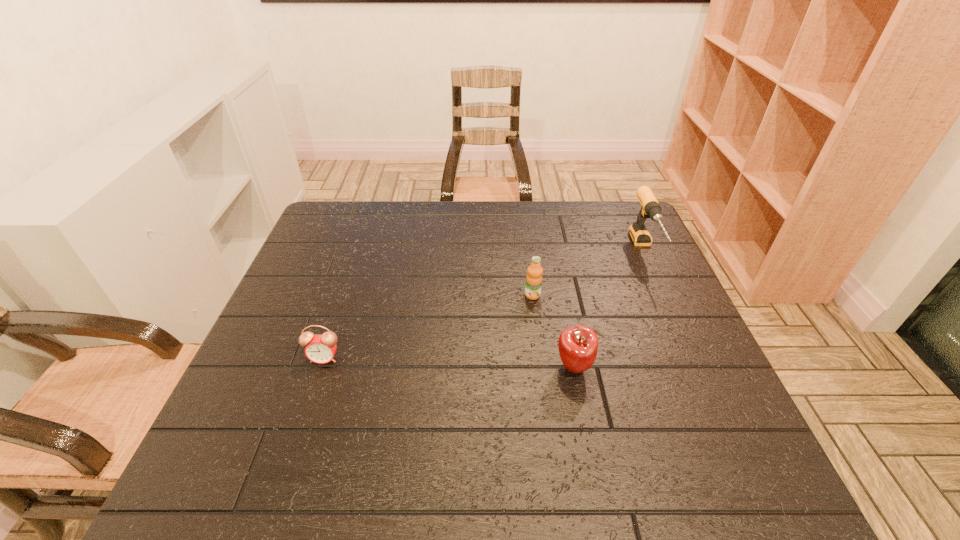
This screenshot has width=960, height=540. I want to click on vacant space that's between the third nearest object and the drill, so click(x=588, y=273).

At what (x,y) coordinates should I click in order to perform the action: click on blank region between the second object from right to left and the drill. Please return your answer as a coordinate pair (x, y). Image resolution: width=960 pixels, height=540 pixels. Looking at the image, I should click on (609, 308).

The image size is (960, 540). What are the coordinates of `free spot between the tallest object and the leftmost object` in the screenshot? It's located at (485, 304).

Where is `vacant region between the apple and the second farthest object`? The image size is (960, 540). vacant region between the apple and the second farthest object is located at coordinates (553, 331).

You are a GUI agent. You are given a task and a screenshot of the screen. Output one action in this format:
    pyautogui.click(x=<x>, y=<y>)
    Task: Click on the empty space that is in between the apple and the leftmost object
    The image size is (960, 540).
    Given the screenshot: What is the action you would take?
    pyautogui.click(x=449, y=362)

The height and width of the screenshot is (540, 960). What are the coordinates of `free spot between the farthest object and the apple` in the screenshot? It's located at pos(609,308).

Find the location of a particular element. Image resolution: width=960 pixels, height=540 pixels. free space between the second object from right to left and the rightmost object is located at coordinates (609, 308).

What are the coordinates of `free space that is in between the apple and the orange juice` in the screenshot? It's located at (553, 331).

Where is `free space between the rightmost object and the orange juice`? This screenshot has width=960, height=540. free space between the rightmost object and the orange juice is located at coordinates point(588,273).

This screenshot has height=540, width=960. I want to click on free spot between the second object from right to left and the rightmost object, so click(609, 308).